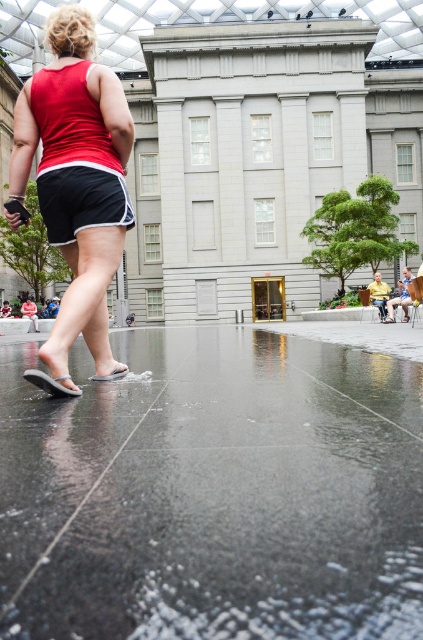
Question: Among these objects, which one is farthest from the camera?

Choices:
 (A) white rubber sandal at lower left
 (B) matte red tank top at center

Answer: (B)

Question: Which point is closer to the camera?

Choices:
 (A) (76, 396)
 (B) (123, 177)
 (C) (107, 374)

Answer: (A)

Question: Is glossy concrete pavement at lower center to the left of white rubber sandal at lower left from the viewer's perspective?

Choices:
 (A) yes
 (B) no

Answer: (B)

Question: Is glossy concrete pavement at lower center above white rubber sandal at lower left?

Choices:
 (A) no
 (B) yes

Answer: (A)

Question: Does glossy concrete pavement at lower center have a larger size compared to white rubber sandal at lower center?

Choices:
 (A) yes
 (B) no

Answer: (A)

Question: Among these objects, which one is nearest to the camera?

Choices:
 (A) glossy concrete pavement at lower center
 (B) matte red tank top at center
 (C) white rubber sandal at lower center
 (D) white rubber sandal at lower left

Answer: (A)